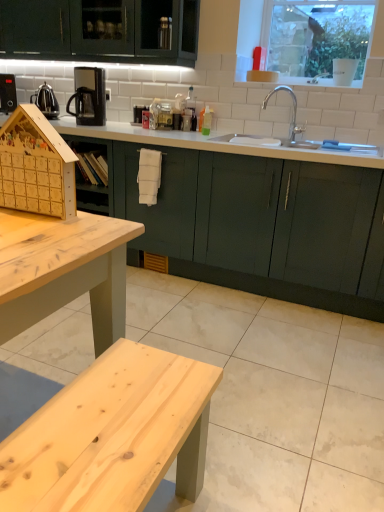
Question: Are white glossy countertop at center and polished stainless steel kettle at left located far from each other?

Choices:
 (A) no
 (B) yes

Answer: (B)

Question: From the image's perspective, is white glossy countertop at center on top of polished stainless steel kettle at left?

Choices:
 (A) no
 (B) yes

Answer: (A)

Question: Can you confirm if white glossy countertop at center is thinner than polished stainless steel kettle at left?

Choices:
 (A) no
 (B) yes

Answer: (A)

Question: Does white glossy countertop at center appear on the left side of polished stainless steel kettle at left?

Choices:
 (A) no
 (B) yes

Answer: (A)

Question: Can you confirm if white glossy countertop at center is positioned to the right of polished stainless steel kettle at left?

Choices:
 (A) yes
 (B) no

Answer: (A)

Question: Do you think polished stainless steel kettle at left is within black plastic coffee machine at upper left, or outside of it?

Choices:
 (A) inside
 (B) outside

Answer: (B)

Question: Based on their sizes in the image, would you say polished stainless steel kettle at left is bigger or smaller than black plastic coffee machine at upper left?

Choices:
 (A) small
 (B) big

Answer: (A)

Question: From a real-world perspective, relative to black plastic coffee machine at upper left, is polished stainless steel kettle at left vertically above or below?

Choices:
 (A) above
 (B) below

Answer: (B)

Question: Would you say polished stainless steel kettle at left is to the left or to the right of black plastic coffee machine at upper left in the picture?

Choices:
 (A) left
 (B) right

Answer: (A)

Question: From the image's perspective, is clear glass window at upper center above or below black plastic coffee machine at upper left?

Choices:
 (A) below
 (B) above

Answer: (B)

Question: Is clear glass window at upper center in front of or behind black plastic coffee machine at upper left in the image?

Choices:
 (A) behind
 (B) front

Answer: (A)

Question: Is clear glass window at upper center inside or outside of black plastic coffee machine at upper left?

Choices:
 (A) inside
 (B) outside

Answer: (B)

Question: Does point click(264, 10) appear closer or farther from the camera than point click(69, 109)?

Choices:
 (A) farther
 (B) closer

Answer: (A)

Question: From a real-world perspective, is clear glass window at upper center physically located above or below wooden advent calendar at left?

Choices:
 (A) below
 (B) above

Answer: (B)

Question: Do you think clear glass window at upper center is within wooden advent calendar at left, or outside of it?

Choices:
 (A) outside
 (B) inside

Answer: (A)